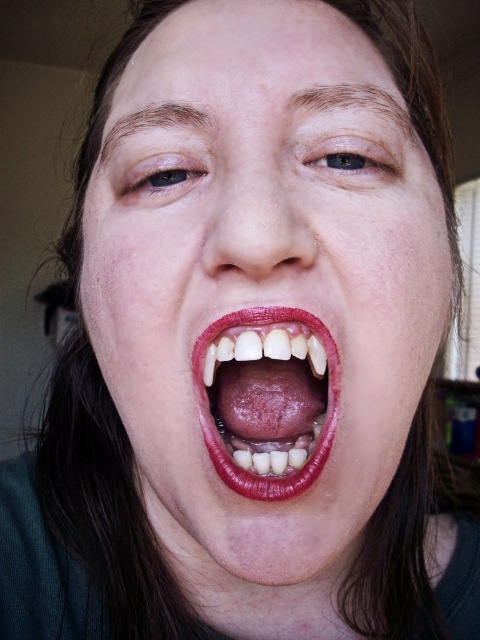
You are a photographer adjusting the focus of your camera. You want to ensure that both the matte skin face at center and the smooth skin at center are in focus. Given their positions, which part should you focus on first to achieve the best depth of field?

You should focus on the matte skin face at center first because it is closer to the viewer than the smooth skin at center. By focusing on the closer object, the depth of field will extend backward, potentially keeping both in focus.

From the picture: You are a photographer adjusting lighting for a portrait session. You notice the subject has a matte skin face at center and a smooth skin at center. Which skin texture should you focus your lighting on to minimize texture visibility?

The matte skin face at center is above smooth skin at center. Since matte skin tends to hide texture better, focus lighting on the matte skin face at center to minimize texture visibility.